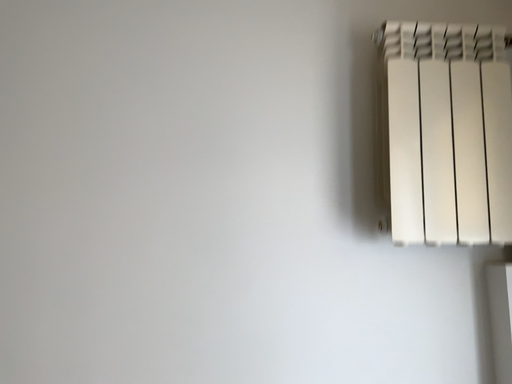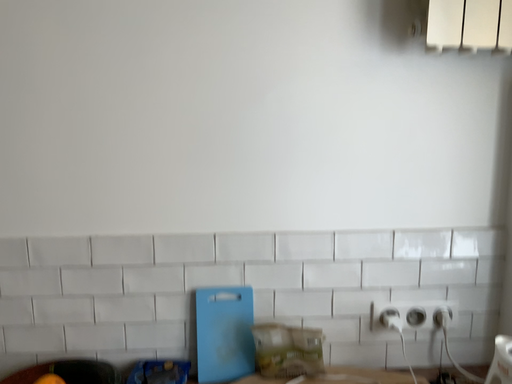
Question: Which way did the camera rotate in the video?

Choices:
 (A) rotated downward
 (B) rotated upward

Answer: (A)